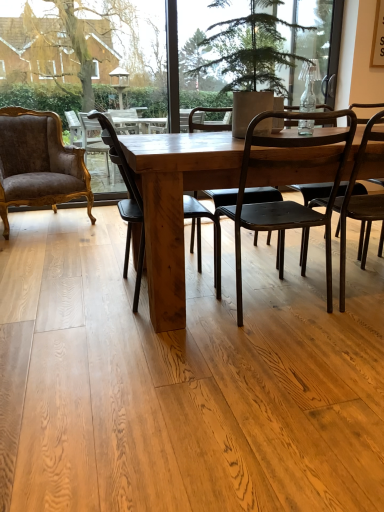
The image size is (384, 512). I want to click on free space on the front side of wooden chair at center, which appears as the 2th chair when viewed from the left, so click(x=149, y=340).